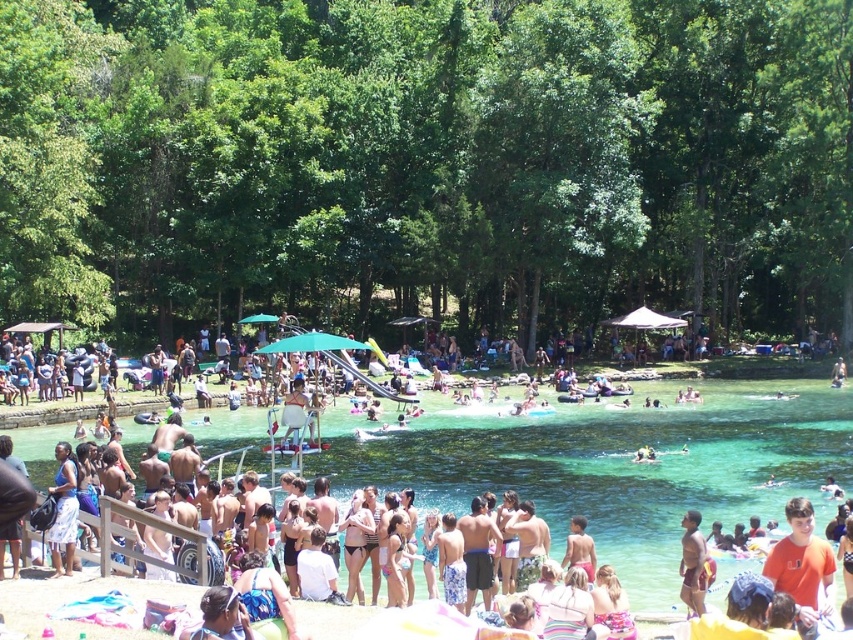
Question: Among these objects, which one is nearest to the camera?

Choices:
 (A) clear water at center
 (B) tan skin human at lower right

Answer: (B)

Question: Does clear water at center have a larger size compared to tan skin human at lower right?

Choices:
 (A) no
 (B) yes

Answer: (B)

Question: Which of the following is the closest to the observer?

Choices:
 (A) (750, 429)
 (B) (691, 596)

Answer: (B)

Question: Which of the following is the farthest from the observer?

Choices:
 (A) tan skin human at lower right
 (B) clear water at center

Answer: (B)

Question: Considering the relative positions of clear water at center and tan skin human at lower right in the image provided, where is clear water at center located with respect to tan skin human at lower right?

Choices:
 (A) below
 (B) above

Answer: (B)

Question: Does clear water at center have a greater width compared to tan skin human at lower right?

Choices:
 (A) no
 (B) yes

Answer: (B)